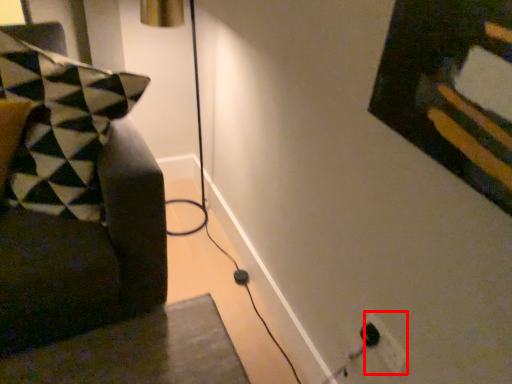
Question: From the image, what is the correct spatial relationship of electric outlet (annotated by the red box) in relation to furniture?

Choices:
 (A) left
 (B) right

Answer: (B)